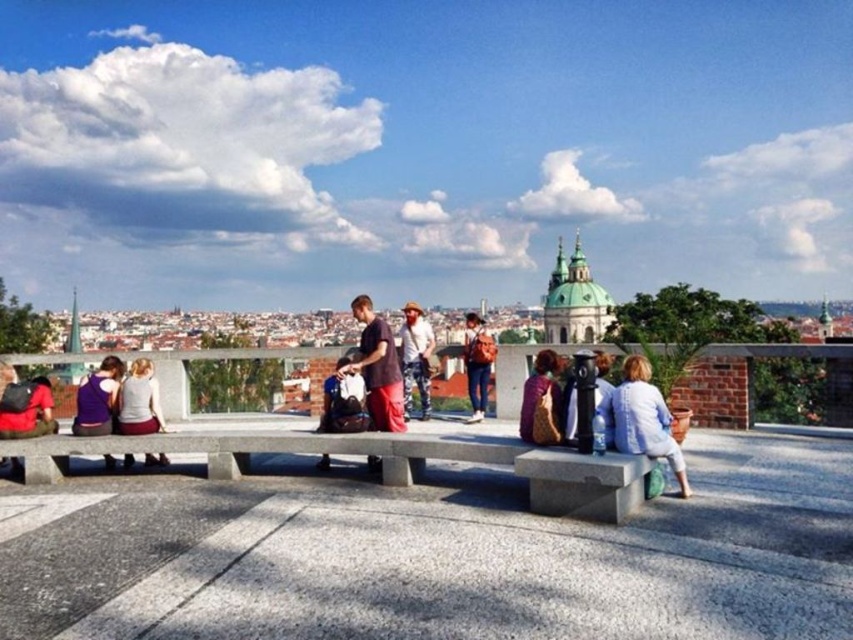
Based on the photo, you are standing at the edge of the paved area and want to sit down. You see the gray concrete bench at center and the denim jacket at center. Which object is closer to your current position?

The gray concrete bench at center is closer to your current position because it is to the left of the denim jacket at center, implying it is nearer in the line of sight.

You are a traveler who just arrived at the scenic spot. You want to place your matte red backpack at left and metallic black telescope at center on the concrete bench where several people are seated. Considering their sizes, which item would require more space on the bench?

The matte red backpack at left has a larger size compared to the metallic black telescope at center, so it would require more space on the bench.

You are standing at the center of the image and want to place a new object at the same 2D coordinates as the matte black backpack at center. What are the coordinates you should use?

The coordinates for the matte black backpack at center are at point (343, 401). So you should use the coordinates 0.628 and 0.403 to place the new object at the same location.